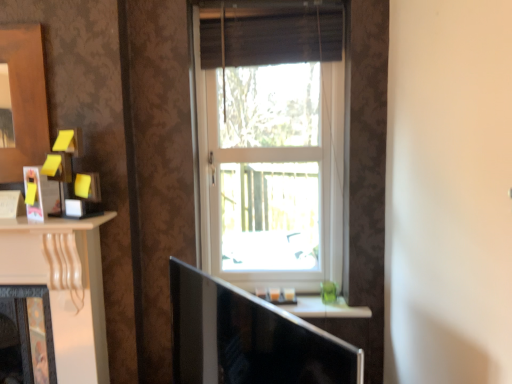
Locate an element on the screen. matte black tv at center is located at coordinates (249, 338).

Describe the element at coordinates (27, 325) in the screenshot. Image resolution: width=512 pixels, height=384 pixels. I see `matte black fireplace at left` at that location.

You are a GUI agent. You are given a task and a screenshot of the screen. Output one action in this format:
    pyautogui.click(x=<x>, y=<y>)
    Task: Click on the white plastic window at center
    Image resolution: width=512 pixels, height=384 pixels.
    Given the screenshot: What is the action you would take?
    pyautogui.click(x=270, y=172)

Image resolution: width=512 pixels, height=384 pixels. Identify the location of brown fabric curtain at upper center. (282, 35).

This screenshot has height=384, width=512. I want to click on matte black picture frame at left, so click(34, 194).

This screenshot has height=384, width=512. Find the location of `matte black tv at center`. matte black tv at center is located at coordinates (249, 338).

Is brown fabric curtain at upper center far away from white glossy window sill at center?

Yes, brown fabric curtain at upper center and white glossy window sill at center are located far from each other.

Is brown fabric curtain at upper center at the left side of white glossy window sill at center?

Indeed, brown fabric curtain at upper center is positioned on the left side of white glossy window sill at center.

Considering the relative sizes of brown fabric curtain at upper center and white glossy window sill at center in the image provided, is brown fabric curtain at upper center shorter than white glossy window sill at center?

No, brown fabric curtain at upper center is not shorter than white glossy window sill at center.

Based on the photo, is brown fabric curtain at upper center oriented away from white glossy window sill at center?

No, brown fabric curtain at upper center's orientation is not away from white glossy window sill at center.

Which object is positioned more to the left, matte black tv at center or white plastic window at center?

Positioned to the left is matte black tv at center.

Who is smaller, matte black tv at center or white plastic window at center?

white plastic window at center is smaller.

From a real-world perspective, does matte black tv at center sit lower than white plastic window at center?

Indeed, from a real-world perspective, matte black tv at center is positioned beneath white plastic window at center.

Is white glossy window sill at center oriented away from white plastic window at center?

No, white plastic window at center is not at the back of white glossy window sill at center.

Is the surface of white glossy window sill at center in direct contact with white plastic window at center?

No, white glossy window sill at center is not in contact with white plastic window at center.

What's the angular difference between white glossy window sill at center and white plastic window at center's facing directions?

The facing directions of white glossy window sill at center and white plastic window at center are 1.32 degrees apart.

Identify the location of window above the matte black tv at center (from a real-world perspective). The image size is (512, 384). (270, 172).

Is white plastic window at center not near matte black tv at center?

No, white plastic window at center is in close proximity to matte black tv at center.

From their relative heights in the image, would you say white plastic window at center is taller or shorter than matte black tv at center?

Clearly, white plastic window at center is taller compared to matte black tv at center.

Which is in front, white plastic window at center or matte black tv at center?

matte black tv at center.

From a real-world perspective, is matte black picture frame at left under white plastic window at center?

Yes, from a real-world perspective, matte black picture frame at left is under white plastic window at center.

Is matte black picture frame at left taller than white plastic window at center?

In fact, matte black picture frame at left may be shorter than white plastic window at center.

Is point (34, 210) closer or farther from the camera than point (243, 252)?

Point (34, 210) is positioned closer to the camera compared to point (243, 252).

Between matte black picture frame at left and white plastic window at center, which one is positioned behind?

white plastic window at center is more distant.

Which point is more distant from viewer, [321,304] or [268,25]?

The point [321,304] is behind.

Can you confirm if white glossy window sill at center is positioned to the left of brown fabric curtain at upper center?

No, white glossy window sill at center is not to the left of brown fabric curtain at upper center.

Consider the image. From a real-world perspective, which object stands above the other?

brown fabric curtain at upper center is physically above.

Is white glossy window sill at center oriented away from brown fabric curtain at upper center?

No.

Is brown fabric curtain at upper center far away from matte black picture frame at left?

brown fabric curtain at upper center is far away from matte black picture frame at left.

From the image's perspective, is brown fabric curtain at upper center under matte black picture frame at left?

No.

Does brown fabric curtain at upper center have a greater height compared to matte black picture frame at left?

Indeed, brown fabric curtain at upper center has a greater height compared to matte black picture frame at left.

This screenshot has height=384, width=512. Identify the location of window sill beneath the brown fabric curtain at upper center (from a real-world perspective). (325, 308).

Locate an element on the screen. The height and width of the screenshot is (384, 512). window above the matte black tv at center (from the image's perspective) is located at coordinates (270, 172).

Based on their spatial positions, is white plastic window at center or matte black tv at center further from white glossy window sill at center?

The object further to white glossy window sill at center is matte black tv at center.

Which object lies nearer to the anchor point matte black tv at center, brown fabric curtain at upper center or matte black picture frame at left?

matte black picture frame at left.

Considering their positions, is white plastic window at center positioned closer to matte black picture frame at left than matte black tv at center?

matte black tv at center lies closer to matte black picture frame at left than the other object.

From the image, which object appears to be farther from matte black picture frame at left, matte black fireplace at left or brown fabric curtain at upper center?

brown fabric curtain at upper center.

Looking at the image, which one is located closer to brown fabric curtain at upper center, matte black picture frame at left or white glossy window sill at center?

matte black picture frame at left lies closer to brown fabric curtain at upper center than the other object.

Estimate the real-world distances between objects in this image. Which object is closer to matte black tv at center, white glossy window sill at center or matte black fireplace at left?

The object closer to matte black tv at center is white glossy window sill at center.

Considering their positions, is matte black picture frame at left positioned further to white plastic window at center than white glossy window sill at center?

matte black picture frame at left is further to white plastic window at center.

Estimate the real-world distances between objects in this image. Which object is further from brown fabric curtain at upper center, white plastic window at center or matte black tv at center?

matte black tv at center is further to brown fabric curtain at upper center.

Find the location of a particular element. The image size is (512, 384). fireplace between matte black tv at center and white plastic window at center in the front-back direction is located at coordinates (27, 325).

Identify the location of window sill between brown fabric curtain at upper center and matte black tv at center in the up-down direction. (325, 308).

Identify the location of picture frame between brown fabric curtain at upper center and matte black fireplace at left vertically. The height and width of the screenshot is (384, 512). (34, 194).

Locate an element on the screen. window between matte black fireplace at left and white glossy window sill at center from left to right is located at coordinates (270, 172).